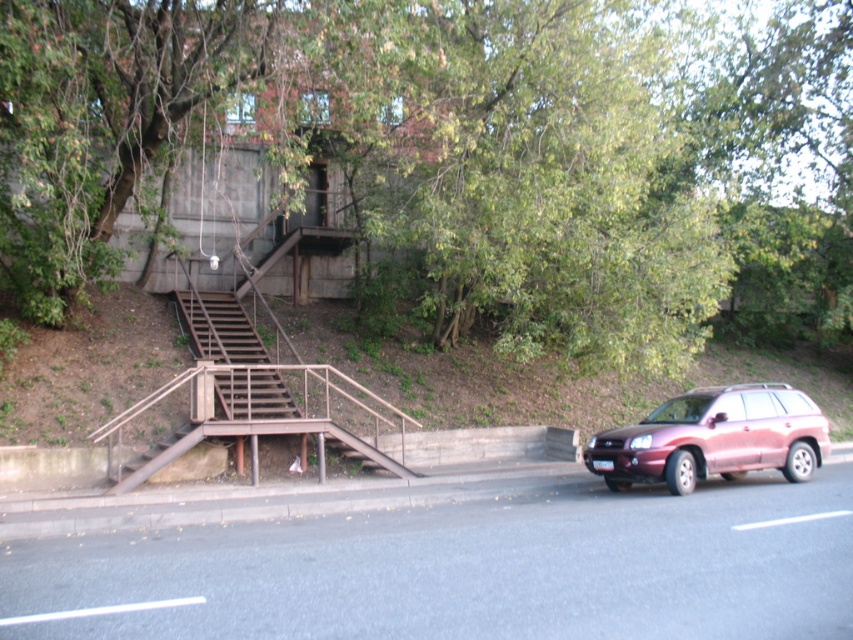
Which of these two, green leafy tree at upper center or brown wooden stairs at left, stands taller?

green leafy tree at upper center is taller.

In the scene shown: Who is shorter, green leafy tree at upper center or brown wooden stairs at left?

Standing shorter between the two is brown wooden stairs at left.

Is point (373, 108) positioned in front of point (282, 413)?

Yes, point (373, 108) is in front of point (282, 413).

I want to click on green leafy tree at upper center, so click(x=463, y=150).

Can you confirm if green leafy tree at upper center is smaller than metallic pink suv at right?

Incorrect, green leafy tree at upper center is not smaller in size than metallic pink suv at right.

How much distance is there between green leafy tree at upper center and metallic pink suv at right?

green leafy tree at upper center is 8.14 meters from metallic pink suv at right.

Identify the location of green leafy tree at upper center. The width and height of the screenshot is (853, 640). (463, 150).

Does metallic pink suv at right appear on the right side of brown wooden stairs at left?

Correct, you'll find metallic pink suv at right to the right of brown wooden stairs at left.

Is metallic pink suv at right thinner than brown wooden stairs at left?

Indeed, metallic pink suv at right has a lesser width compared to brown wooden stairs at left.

Measure the distance between point (798, 422) and camera.

Point (798, 422) and camera are 42.30 feet apart from each other.

In order to click on metallic pink suv at right in this screenshot , I will do `click(714, 438)`.